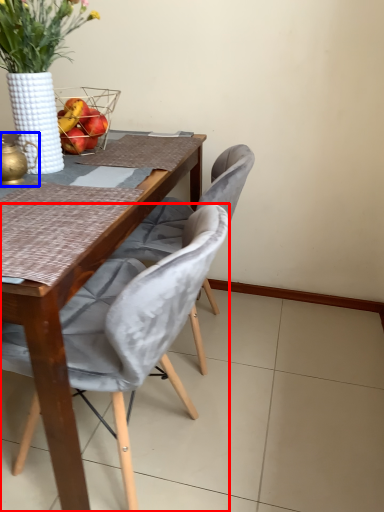
Question: Which object appears closest to the camera in this image, chair (highlighted by a red box) or tea pot (highlighted by a blue box)?

Choices:
 (A) chair
 (B) tea pot

Answer: (A)